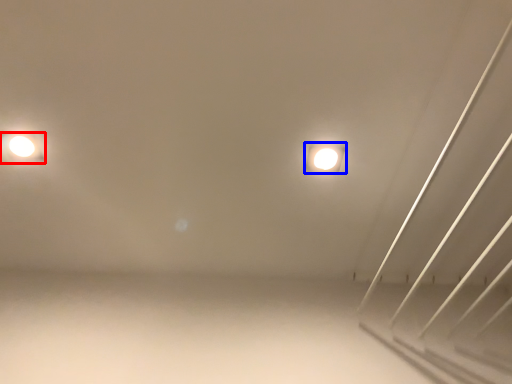
Question: Which object appears closest to the camera in this image, lamp (highlighted by a red box) or lamp (highlighted by a blue box)?

Choices:
 (A) lamp
 (B) lamp

Answer: (A)